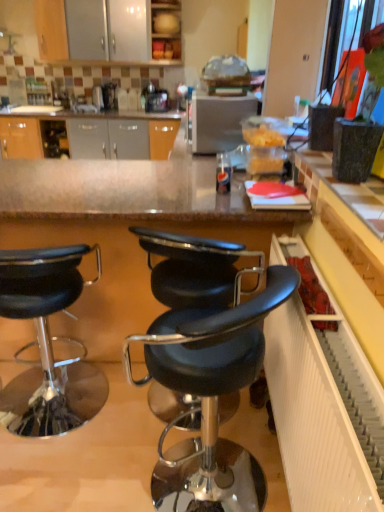
Locate an element on the screen. The height and width of the screenshot is (512, 384). blank space situated above white glossy sink at upper center (from a real-world perspective) is located at coordinates (83, 100).